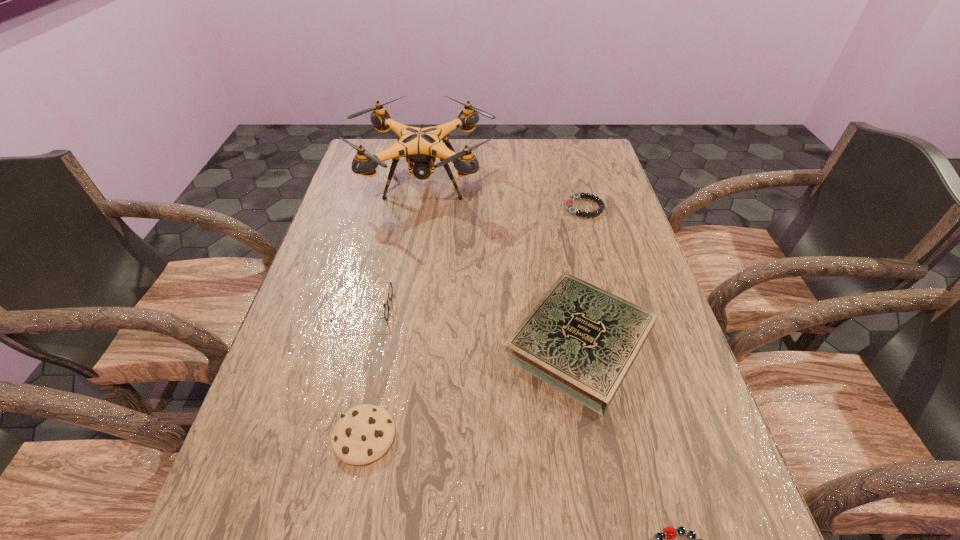
The height and width of the screenshot is (540, 960). I want to click on vacant space located on the front of the taller bracelet, so click(x=608, y=289).

Where is `object that is at the far edge`? object that is at the far edge is located at coordinates (421, 146).

The width and height of the screenshot is (960, 540). In order to click on drone present at the left edge in this screenshot , I will do `click(421, 146)`.

Find the location of a particular element. sunglasses that is at the left edge is located at coordinates (386, 311).

In order to click on cookie at the left edge in this screenshot , I will do `click(362, 435)`.

The image size is (960, 540). What are the coordinates of `hardback book present at the right edge` in the screenshot? It's located at (582, 340).

At what (x,y) coordinates should I click in order to perform the action: click on bracelet that is at the right edge. Please return your answer as a coordinate pair (x, y). Looking at the image, I should click on (569, 202).

Locate an element on the screen. The height and width of the screenshot is (540, 960). object that is at the far left corner is located at coordinates (421, 146).

This screenshot has width=960, height=540. I want to click on vacant space at the far edge of the desktop, so click(453, 143).

Find the location of a particular element. This screenshot has width=960, height=540. blank space at the left edge of the desktop is located at coordinates (338, 382).